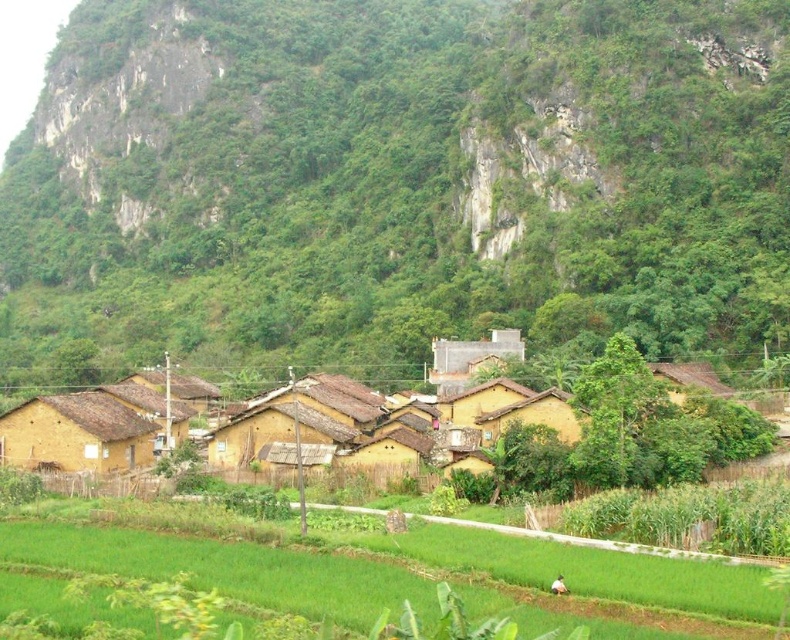
Question: Is green grass at lower center further to camera compared to yellow mud hut at lower left?

Choices:
 (A) no
 (B) yes

Answer: (A)

Question: Can you confirm if green rocky mountain at upper center is positioned to the right of yellow clay houses at center?

Choices:
 (A) no
 (B) yes

Answer: (A)

Question: Which object is the closest to the yellow clay houses at center?

Choices:
 (A) green rocky mountain at upper center
 (B) yellow mud hut at lower left
 (C) green grass at lower center

Answer: (B)

Question: Does green rocky mountain at upper center appear on the left side of yellow mud hut at lower left?

Choices:
 (A) yes
 (B) no

Answer: (A)

Question: Which object is farther from the camera taking this photo?

Choices:
 (A) green grass at lower center
 (B) yellow clay houses at center
 (C) yellow mud hut at lower left
 (D) green rocky mountain at upper center

Answer: (D)

Question: Which of the following is the farthest from the observer?

Choices:
 (A) green grass at lower center
 (B) green rocky mountain at upper center

Answer: (B)